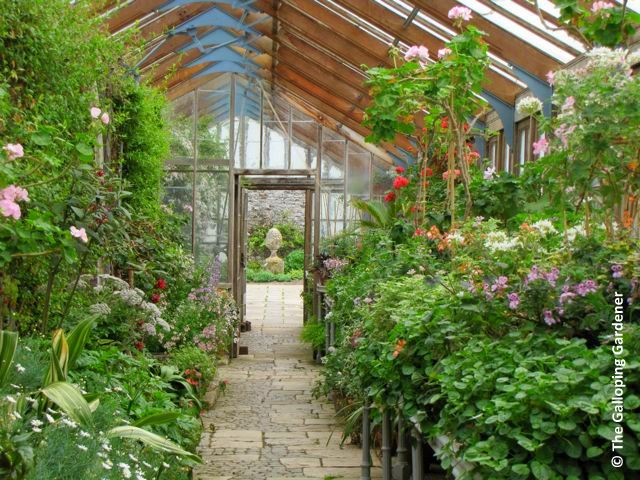
The height and width of the screenshot is (480, 640). What are the coordinates of `entrance` in the screenshot? It's located at (281, 217).